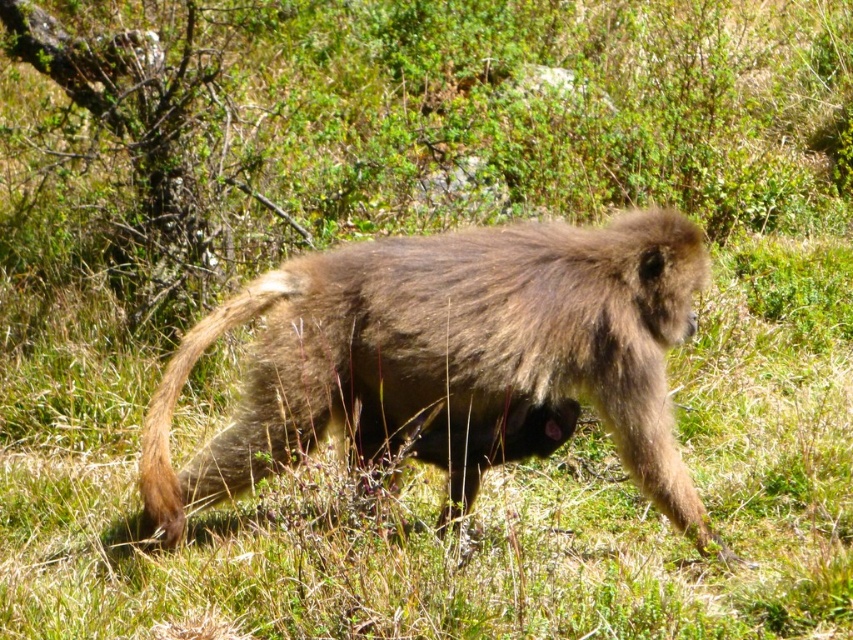
Question: Does brown furry monkey at center come behind brown fuzzy tail at lower left?

Choices:
 (A) no
 (B) yes

Answer: (A)

Question: Can you confirm if brown furry monkey at center is bigger than brown fuzzy tail at lower left?

Choices:
 (A) yes
 (B) no

Answer: (A)

Question: Which point is closer to the camera?

Choices:
 (A) (160, 481)
 (B) (296, 288)

Answer: (A)

Question: Among these points, which one is farthest from the camera?

Choices:
 (A) (149, 504)
 (B) (640, 257)

Answer: (B)

Question: Does brown furry monkey at center have a greater width compared to brown fuzzy tail at lower left?

Choices:
 (A) no
 (B) yes

Answer: (B)